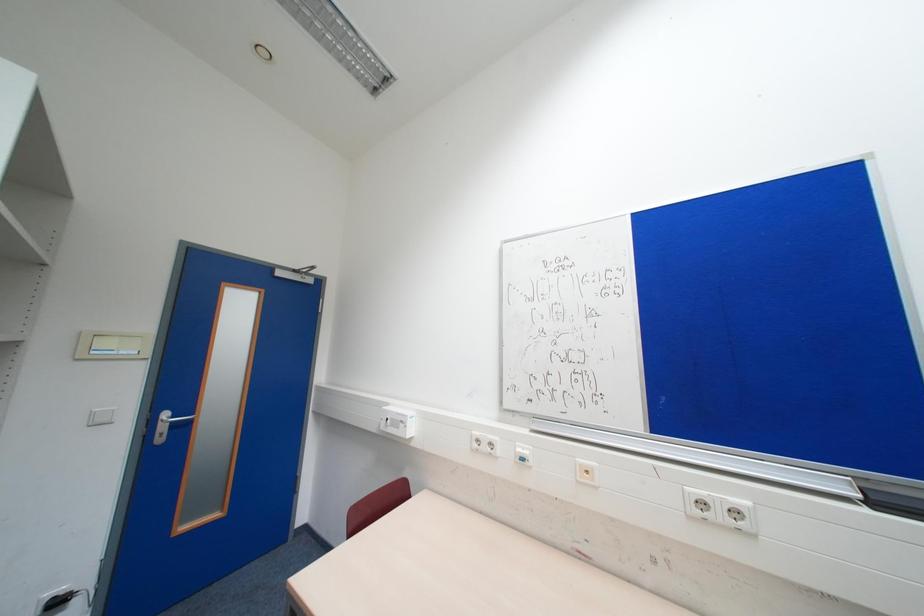
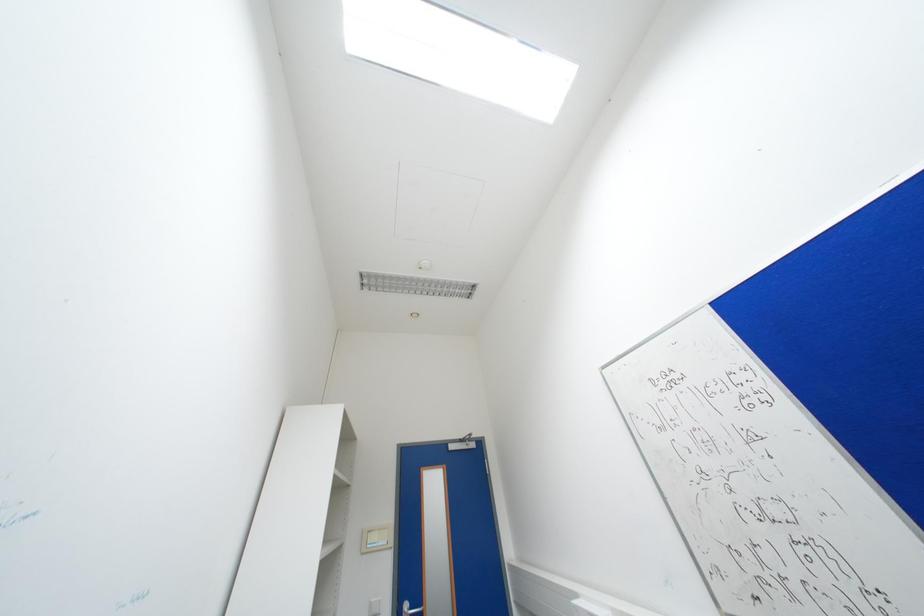
How did the camera likely rotate?

The camera rotated toward left-up.